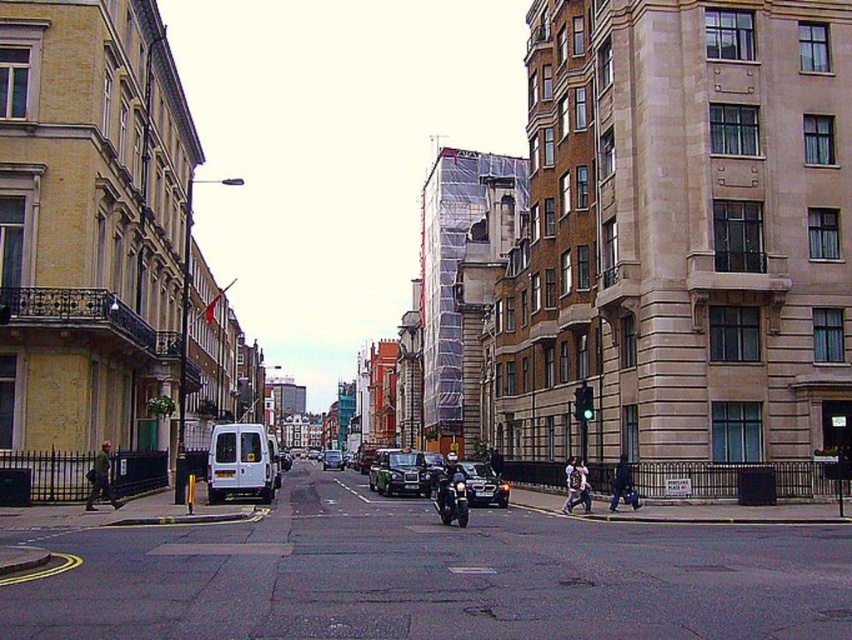
You are a delivery person needing to park your 2.5 meters wide delivery van. You see a black metallic car at center and a dark gray jacket at left. Which parking spot between these two objects can accommodate your van?

The black metallic car at center has a width surpassing the dark gray jacket at left, so the parking spot between the black metallic car at center and the dark gray jacket at left can accommodate your 2.5 meters wide delivery van if the space between them is at least 2.5 meters.

You are a delivery person who needs to load a large package into your delivery van. The van has a height restriction of 1.8 meters. You see the black metallic car at center and the dark gray jacket at left in the scene. Which object is taller than the height restriction?

The black metallic car at center is much taller than the dark gray jacket at left. Since the height restriction is 1.8 meters, the black metallic car at center is likely taller than this limit, making it unsuitable for loading the package into the van.

You are a delivery driver who needs to park your black metallic car at center in a parking spot that is 30 meters away from the camera. Can your car fit in the parking spot without moving forward or backward?

The black metallic car at center is 28.60 meters from the camera. Since the parking spot is 30 meters away, the car is closer than the required distance. Therefore, the car cannot reach the parking spot without moving forward to cover the remaining 1.4 meters.